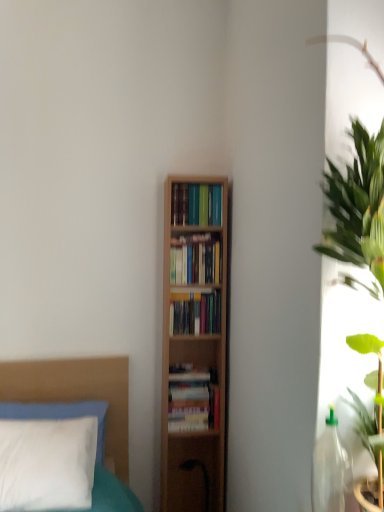
Find the location of a particular element. Image resolution: width=384 pixels, height=512 pixels. free space above wooden bookshelf at center, marked as the second book in a top-to-bottom arrangement (from a real-world perspective) is located at coordinates (201, 241).